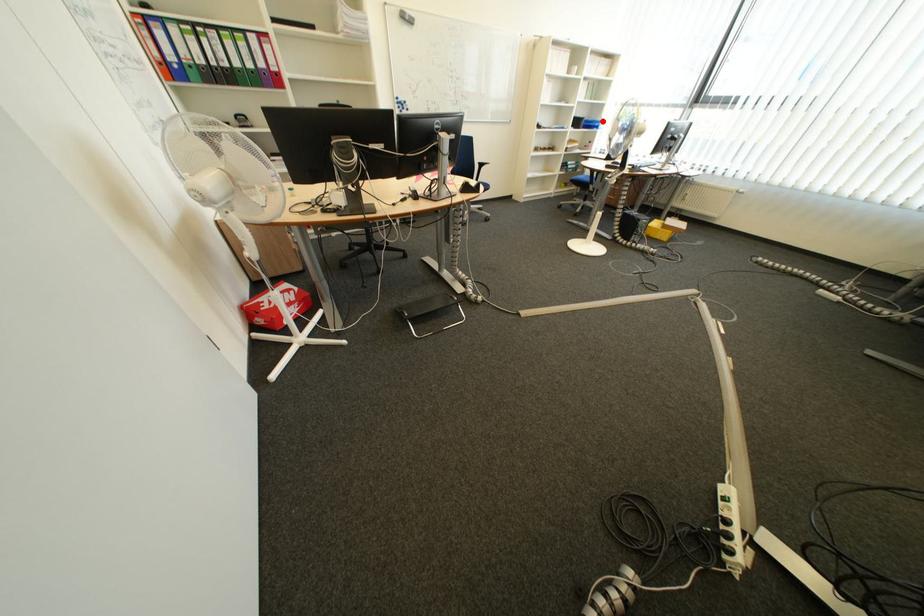
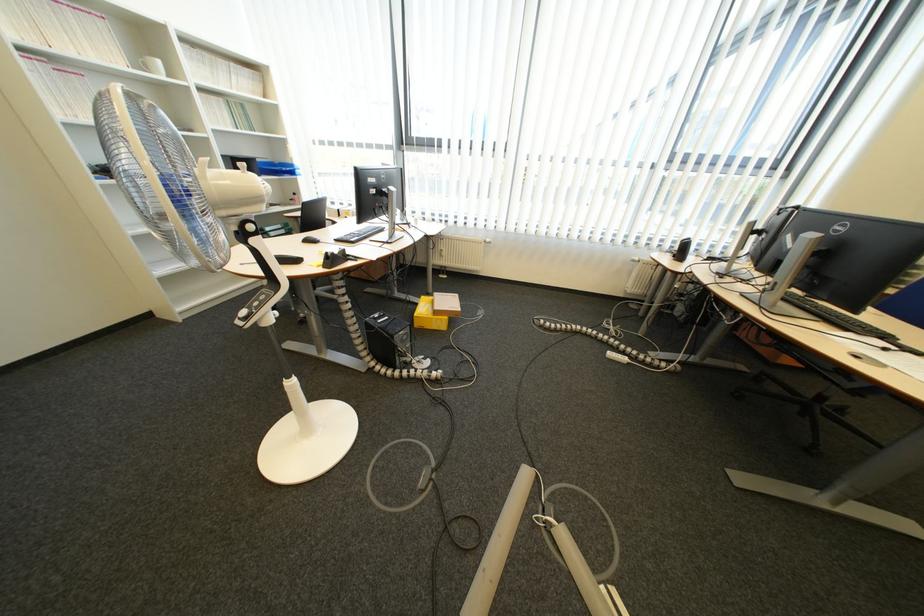
Question: A red point is marked in image1. In image2, is the corresponding 3D point closer to the camera or farther? Reply with the corresponding letter.

Choices:
 (A) The corresponding 3D point is closer.
 (B) The corresponding 3D point is farther.

Answer: (B)